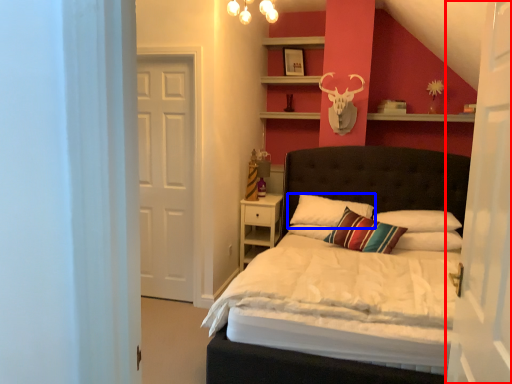
Question: Which point is closer to the camera, door (highlighted by a red box) or pillow (highlighted by a blue box)?

Choices:
 (A) door
 (B) pillow

Answer: (A)